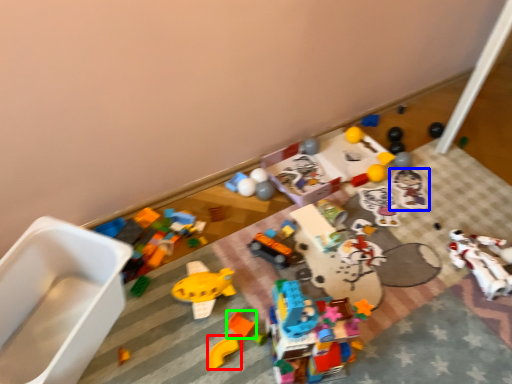
Question: Based on their relative distances, which object is farther from toy (highlighted by a red box)? Choose from toy (highlighted by a blue box) and toy (highlighted by a green box).

Choices:
 (A) toy
 (B) toy

Answer: (A)